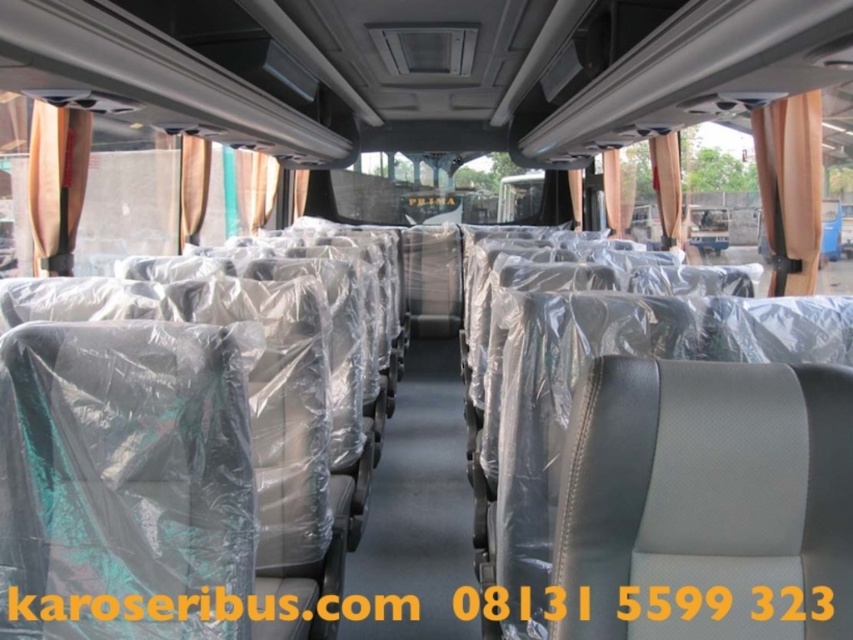
You are a bus passenger who wants to block the sunlight coming from the windows. You see the orange fabric curtain at upper right and the metallic gold curtain at left. Which curtain should you pull to block the sunlight if you are sitting in the middle of the bus?

The orange fabric curtain at upper right is taller than the metallic gold curtain at left, so it would provide better coverage against sunlight. Pull the orange fabric curtain at upper right to block the sunlight effectively.

You are a passenger on the bus and want to locate the orange fabric curtain at upper right. Based on the scene description, where would you look in relation to your seating position?

The orange fabric curtain at upper right is located at point coordinates 0.294 on the horizontal axis and 0.927 on the vertical axis, meaning it is positioned near the upper right corner of the bus interior.

You are standing at the camera position in the bus interior. There is a point marked at coordinates point (799, 244). Can you reach that point without moving your position?

The distance between point (799, 244) and the camera is 3.52 meters. Since you are at the camera position, you cannot physically reach the point which is 3.52 meters away without moving.